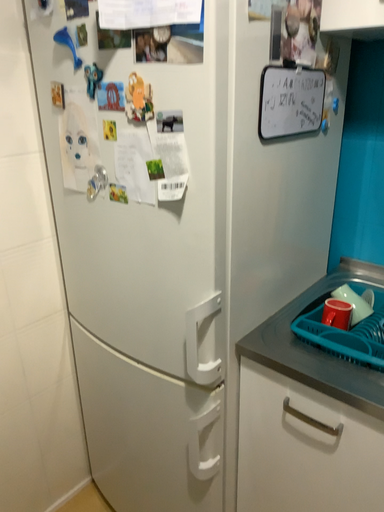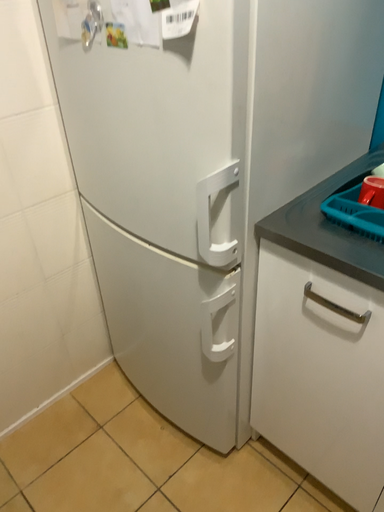
Question: How did the camera likely rotate when shooting the video?

Choices:
 (A) rotated downward
 (B) rotated upward

Answer: (A)